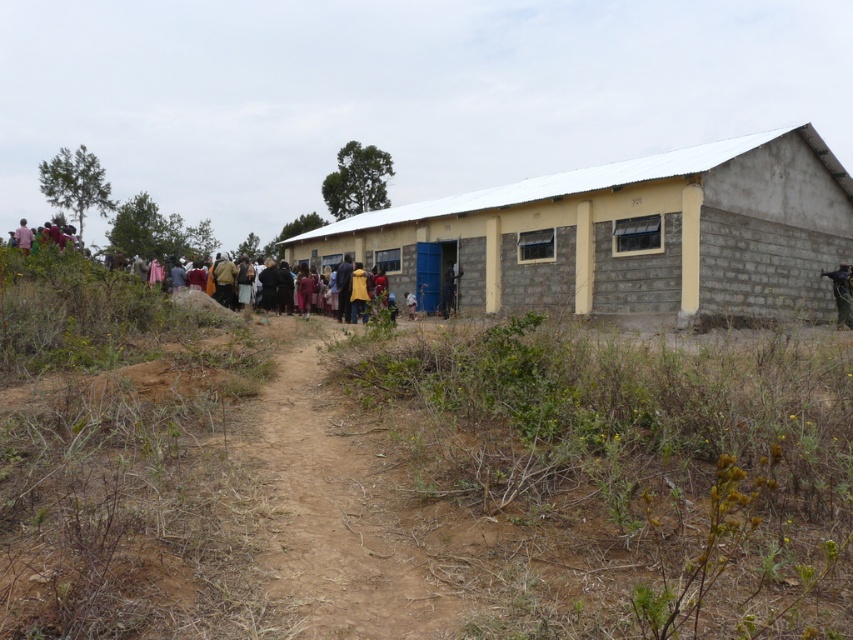
Question: Which of the following is the closest to the observer?

Choices:
 (A) brown dirt track at center
 (B) gray concrete building at center
 (C) brown dirt field at center

Answer: (C)

Question: Which point is closer to the camera?

Choices:
 (A) brown dirt track at center
 (B) gray concrete building at center
 (C) brown dirt field at center

Answer: (C)

Question: Observing the image, what is the correct spatial positioning of brown dirt field at center in reference to gray concrete building at center?

Choices:
 (A) right
 (B) left

Answer: (A)

Question: Does brown dirt field at center appear under gray concrete building at center?

Choices:
 (A) no
 (B) yes

Answer: (B)

Question: Is brown dirt field at center bigger than gray concrete building at center?

Choices:
 (A) no
 (B) yes

Answer: (A)

Question: Which point is farther from the camera taking this photo?

Choices:
 (A) (416, 557)
 (B) (35, 522)
 (C) (779, 288)

Answer: (C)